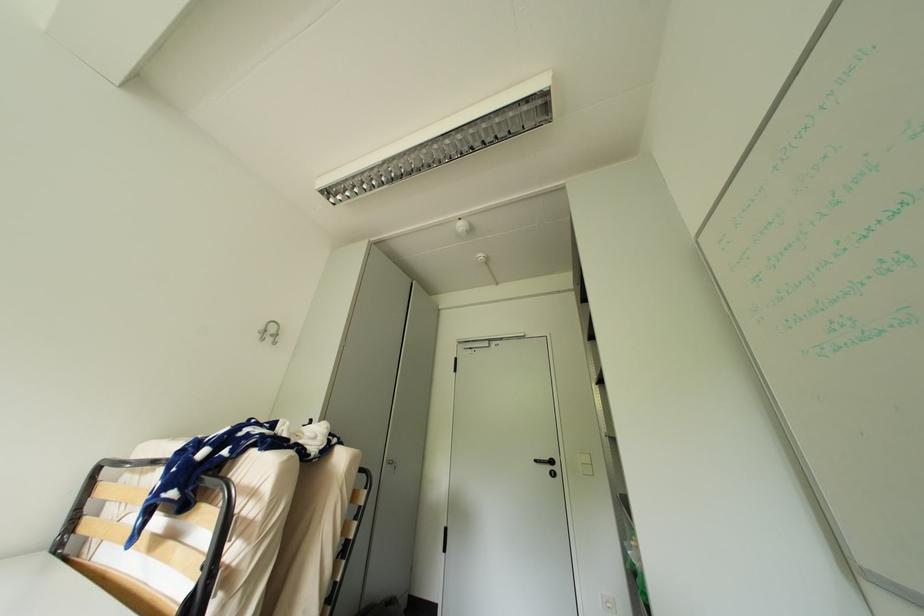
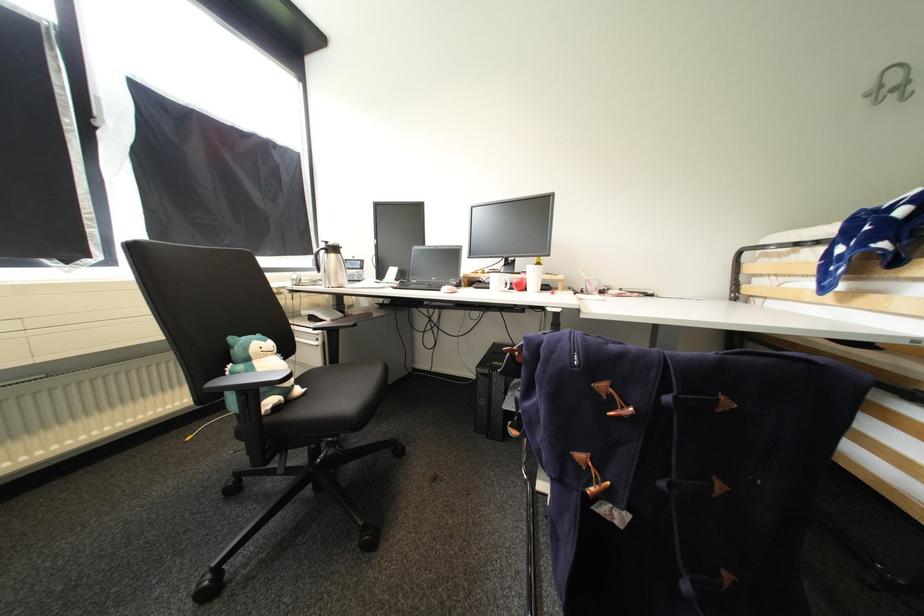
Where in the second image is the point corresponding to point (283, 336) from the first image?

(912, 84)